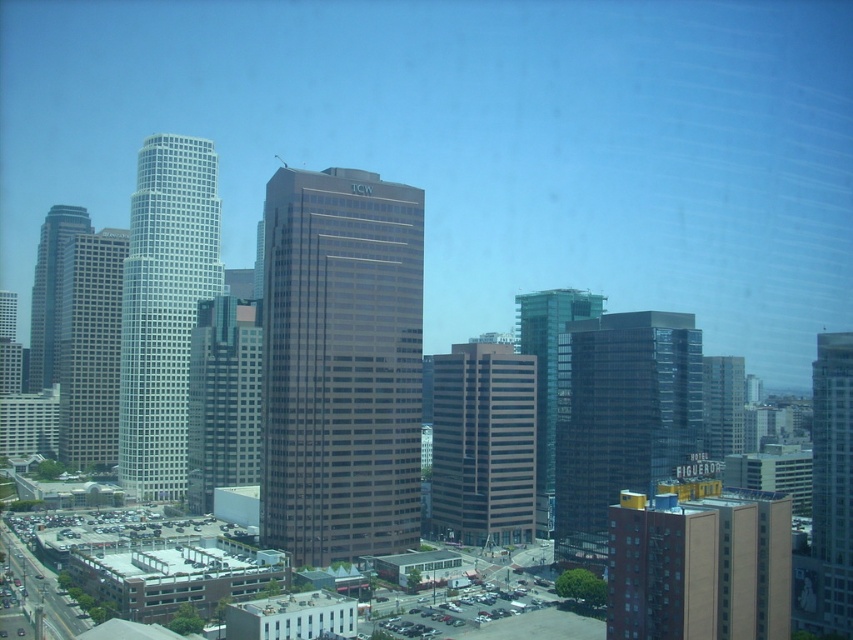
You are standing at the point labeled as point (619,419) in the cityscape. Looking around, you notice the glassy reflective skyscraper at center right. Based on your position, which direction should you face to see the tallest building with the letters TCW?

The point (619,419) is located at the glassy reflective skyscraper at center right. The tallest building with TCW is likely positioned centrally in the scene. Facing towards the center from the center right position would mean turning slightly to the left to face the central area where the TCW building stands.